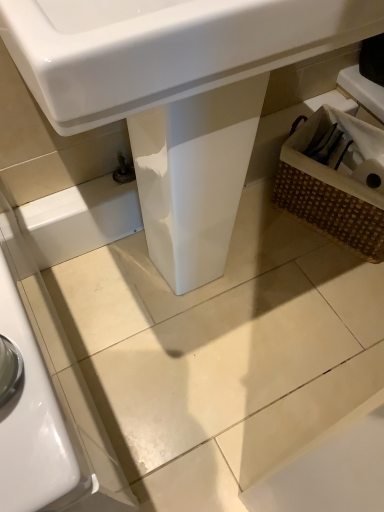
Question: From the image's perspective, is brown woven basket at right above or below white glossy sink at center?

Choices:
 (A) above
 (B) below

Answer: (B)

Question: Is point (372, 159) positioned closer to the camera than point (233, 48)?

Choices:
 (A) closer
 (B) farther

Answer: (B)

Question: In the image, is brown woven basket at right positioned in front of or behind white glossy sink at center?

Choices:
 (A) front
 (B) behind

Answer: (B)

Question: Would you say white glossy sink at center is to the left or to the right of brown woven basket at right in the picture?

Choices:
 (A) right
 (B) left

Answer: (B)

Question: Considering their positions, is white glossy sink at center located in front of or behind brown woven basket at right?

Choices:
 (A) behind
 (B) front

Answer: (B)

Question: Does point [x=251, y=126] appear closer or farther from the camera than point [x=375, y=254]?

Choices:
 (A) closer
 (B) farther

Answer: (A)

Question: Choose the correct answer: Is white glossy sink at center inside brown woven basket at right or outside it?

Choices:
 (A) outside
 (B) inside

Answer: (A)